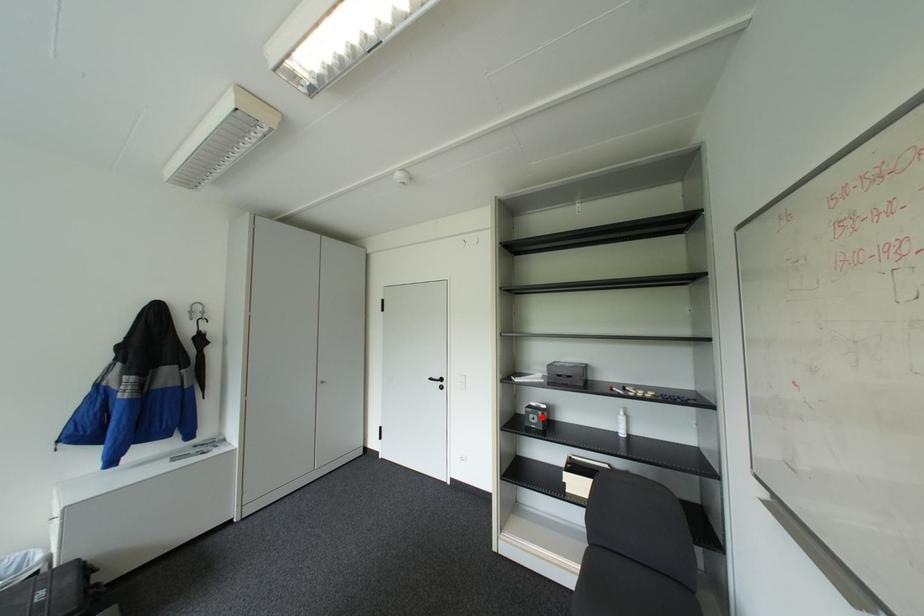
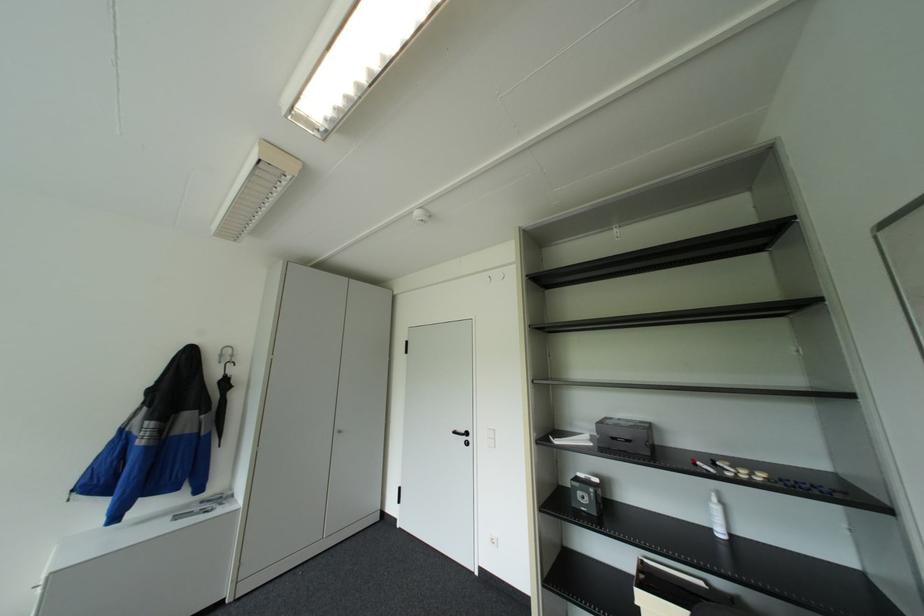
Where in the second image is the point corresponding to the highlighted location from the first image?

(591, 496)